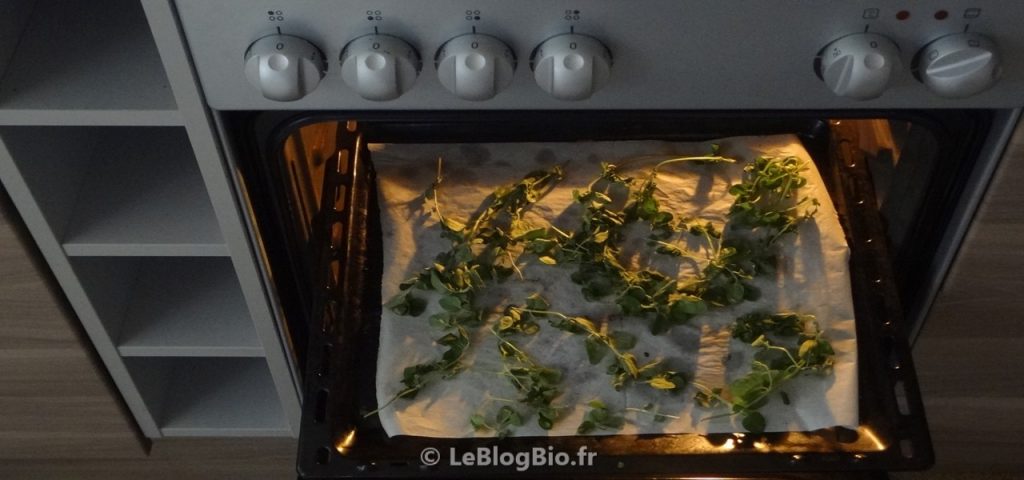
Locate an element on the screen. wooden floor is located at coordinates (941, 364).